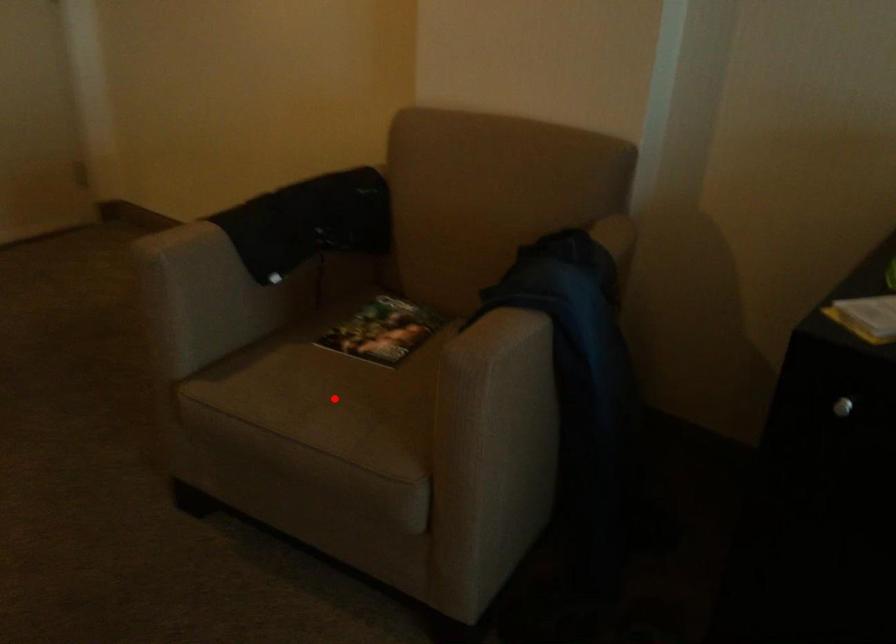
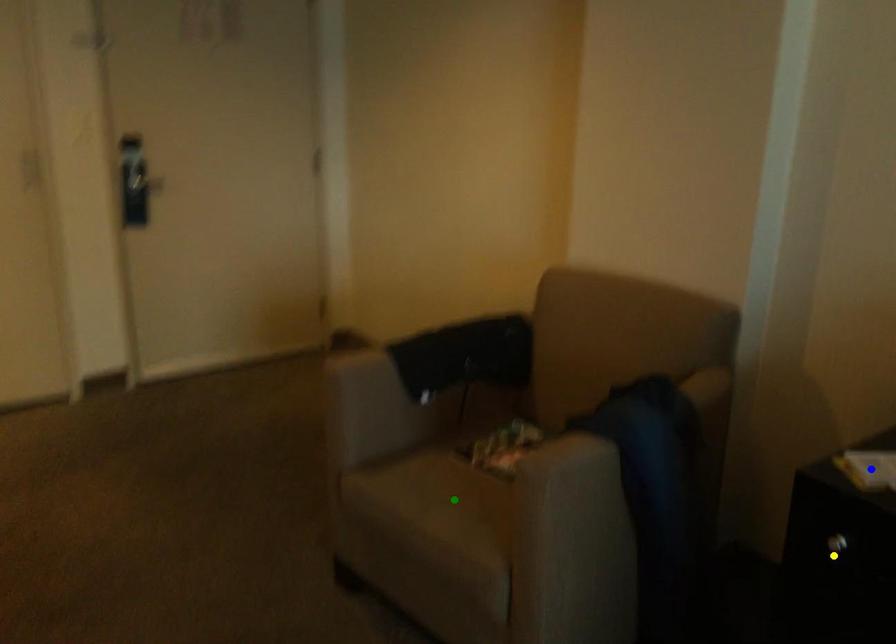
Question: I am providing you with two images of the same scene from different viewpoints. A red point is marked on the first image. You are given multiple points on the second image. Which point in image 2 is actually the same real-world point as the red point in image 1?

Choices:
 (A) blue point
 (B) yellow point
 (C) green point

Answer: (C)